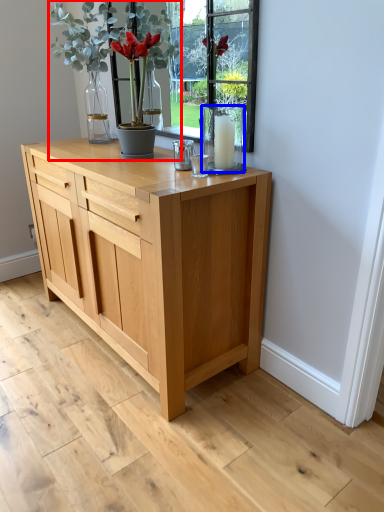
Question: Among these objects, which one is nearest to the camera, houseplant (highlighted by a red box) or glass vase (highlighted by a blue box)?

Choices:
 (A) houseplant
 (B) glass vase

Answer: (B)